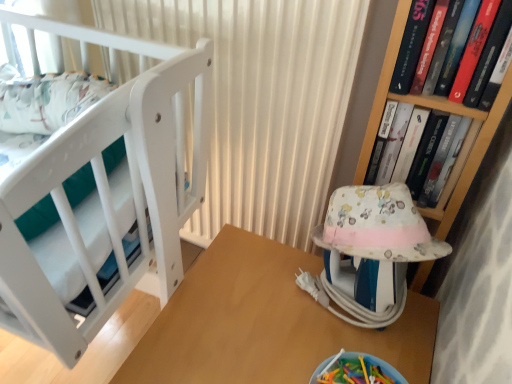
Question: In terms of width, does hardcover book at upper right, the first book in the front-to-back sequence, look wider or thinner when compared to fluffy fabric baby carriage at right?

Choices:
 (A) thin
 (B) wide

Answer: (A)

Question: From their relative heights in the image, would you say hardcover book at upper right, the first book in the front-to-back sequence, is taller or shorter than fluffy fabric baby carriage at right?

Choices:
 (A) tall
 (B) short

Answer: (A)

Question: Which of these objects is positioned farthest from the white matte curtain at upper center?

Choices:
 (A) wooden table at center
 (B) fluffy fabric baby carriage at right
 (C) hardcover book at upper right, the second book when ordered from front to back
 (D) hardcover book at upper right, positioned as the second book in back-to-front order
 (E) white matte crib at left

Answer: (C)

Question: Which is farther from the white matte crib at left?

Choices:
 (A) white matte curtain at upper center
 (B) wooden table at center
 (C) hardcover book at upper right, positioned as the second book in back-to-front order
 (D) hardcover book at upper right, the second book when ordered from front to back
 (E) fluffy fabric baby carriage at right

Answer: (D)